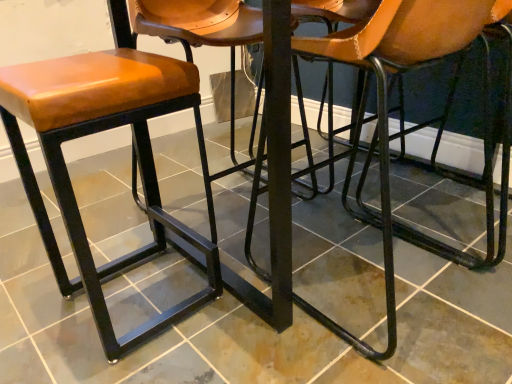
Find the location of a particular element. The width and height of the screenshot is (512, 384). matte brown leather stool at left is located at coordinates (97, 132).

This screenshot has width=512, height=384. I want to click on matte black stool at center, so click(252, 327).

Find the location of a particular element. The image size is (512, 384). tile below the matte brown leather stool at left (from a real-world perspective) is located at coordinates (x=252, y=327).

What's the angular difference between matte black stool at center and matte brown leather stool at left's facing directions?

89.3 degrees separate the facing orientations of matte black stool at center and matte brown leather stool at left.

From the image's perspective, between matte black stool at center and matte brown leather stool at left, who is located below?

matte black stool at center is shown below in the image.

Is matte black stool at center in contact with matte brown leather stool at left?

matte black stool at center and matte brown leather stool at left are clearly separated.

In terms of size, does brown leather chair at center appear bigger or smaller than matte black stool at center?

Considering their sizes, brown leather chair at center takes up less space than matte black stool at center.

This screenshot has width=512, height=384. In the image, there is a brown leather chair at center. Identify the location of tile below it (from the image's perspective). (252, 327).

Is brown leather chair at center completely or partially outside of matte black stool at center?

Yes, brown leather chair at center is outside of matte black stool at center.

From a real-world perspective, which object stands above the other?

brown leather chair at center.

Is matte brown leather stool at left further to the viewer compared to brown leather chair at center?

Yes, the depth of matte brown leather stool at left is greater than that of brown leather chair at center.

Where is `chair above the matte brown leather stool at left (from a real-world perspective)`? Image resolution: width=512 pixels, height=384 pixels. chair above the matte brown leather stool at left (from a real-world perspective) is located at coordinates (383, 110).

How different are the orientations of matte brown leather stool at left and brown leather chair at center in degrees?

90 degrees separate the facing orientations of matte brown leather stool at left and brown leather chair at center.

Is matte brown leather stool at left not within brown leather chair at center?

Yes.

Who is taller, matte brown leather stool at left or matte black stool at center?

Standing taller between the two is matte brown leather stool at left.

From the image's perspective, is matte brown leather stool at left located beneath matte black stool at center?

No, from the image's perspective, matte brown leather stool at left is not below matte black stool at center.

Which object is thinner, matte brown leather stool at left or matte black stool at center?

With smaller width is matte brown leather stool at left.

How different are the orientations of matte brown leather stool at left and matte black stool at center in degrees?

They differ by 89.3 degrees in their facing directions.

From a real-world perspective, does matte black stool at center stand above brown leather chair at center?

No, from a real-world perspective, matte black stool at center is not on top of brown leather chair at center.

Does matte black stool at center touch brown leather chair at center?

matte black stool at center and brown leather chair at center are clearly separated.

Which object is closer to the camera taking this photo, matte black stool at center or brown leather chair at center?

matte black stool at center is in front.

Can we say matte black stool at center lies outside brown leather chair at center?

That's correct, matte black stool at center is outside of brown leather chair at center.

From the image's perspective, is brown leather chair at center located above or below matte brown leather stool at left?

Based on their image positions, brown leather chair at center is located above matte brown leather stool at left.

Can you confirm if brown leather chair at center is positioned to the right of matte brown leather stool at left?

Correct, you'll find brown leather chair at center to the right of matte brown leather stool at left.

Does brown leather chair at center come behind matte brown leather stool at left?

No, it is in front of matte brown leather stool at left.

Find the location of a particular element. Image resolution: width=512 pixels, height=384 pixels. tile below the matte brown leather stool at left (from the image's perspective) is located at coordinates (252, 327).

Where is `chair above the matte black stool at center (from a real-world perspective)`? Image resolution: width=512 pixels, height=384 pixels. chair above the matte black stool at center (from a real-world perspective) is located at coordinates (383, 110).

Estimate the real-world distances between objects in this image. Which object is closer to brown leather chair at center, matte black stool at center or matte brown leather stool at left?

matte black stool at center lies closer to brown leather chair at center than the other object.

Which object lies further to the anchor point matte black stool at center, brown leather chair at center or matte brown leather stool at left?

brown leather chair at center is further to matte black stool at center.

Looking at the image, which one is located further to brown leather chair at center, matte brown leather stool at left or matte black stool at center?

matte brown leather stool at left is further to brown leather chair at center.

When comparing their distances from matte black stool at center, does matte brown leather stool at left or brown leather chair at center seem closer?

Based on the image, matte brown leather stool at left appears to be nearer to matte black stool at center.

When comparing their distances from matte brown leather stool at left, does brown leather chair at center or matte black stool at center seem closer?

matte black stool at center is closer to matte brown leather stool at left.

Considering their positions, is matte black stool at center positioned closer to matte brown leather stool at left than brown leather chair at center?

Based on the image, matte black stool at center appears to be nearer to matte brown leather stool at left.

I want to click on tile situated between matte brown leather stool at left and brown leather chair at center from left to right, so click(x=252, y=327).